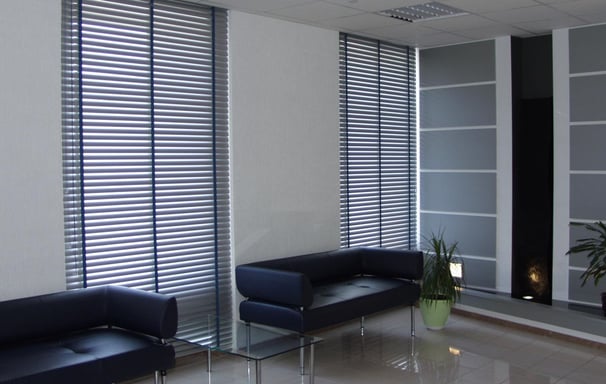
Where is `table legs`? The width and height of the screenshot is (606, 384). table legs is located at coordinates (253, 375), (216, 362), (250, 338).